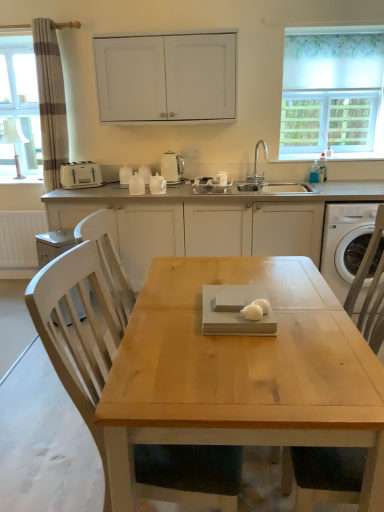
Question: From a real-world perspective, is white plastic dishwasher at lower left located beneath light wood chair at center?

Choices:
 (A) yes
 (B) no

Answer: (A)

Question: Does white plastic dishwasher at lower left have a greater width compared to light wood chair at center?

Choices:
 (A) yes
 (B) no

Answer: (B)

Question: Considering the relative sizes of white plastic dishwasher at lower left and light wood chair at center in the image provided, is white plastic dishwasher at lower left smaller than light wood chair at center?

Choices:
 (A) yes
 (B) no

Answer: (A)

Question: Can you confirm if white plastic dishwasher at lower left is shorter than light wood chair at center?

Choices:
 (A) no
 (B) yes

Answer: (B)

Question: Does white plastic dishwasher at lower left turn towards light wood chair at center?

Choices:
 (A) yes
 (B) no

Answer: (B)

Question: From the image's perspective, is silver metallic faucet at sink right above or below white plastic washing machine at right?

Choices:
 (A) below
 (B) above

Answer: (B)

Question: Considering the positions of point (266, 157) and point (334, 271), is point (266, 157) closer or farther from the camera than point (334, 271)?

Choices:
 (A) farther
 (B) closer

Answer: (A)

Question: Is silver metallic faucet at sink right situated inside white plastic washing machine at right or outside?

Choices:
 (A) outside
 (B) inside

Answer: (A)

Question: In terms of width, does silver metallic faucet at sink right look wider or thinner when compared to white plastic washing machine at right?

Choices:
 (A) wide
 (B) thin

Answer: (B)

Question: In terms of width, does white matte cabinet at upper center, which is the 1th cabinetry in top-to-bottom order, look wider or thinner when compared to white fabric at upper right?

Choices:
 (A) thin
 (B) wide

Answer: (B)

Question: Looking at the image, does white matte cabinet at upper center, the 2th cabinetry from the bottom, seem bigger or smaller compared to white fabric at upper right?

Choices:
 (A) small
 (B) big

Answer: (B)

Question: From a real-world perspective, is white matte cabinet at upper center, the 2th cabinetry from the bottom, positioned above or below white fabric at upper right?

Choices:
 (A) below
 (B) above

Answer: (B)

Question: Is white matte cabinet at upper center, the 2th cabinetry from the bottom, in front of or behind white fabric at upper right in the image?

Choices:
 (A) front
 (B) behind

Answer: (A)

Question: Visually, is white plastic dishwasher at lower left positioned to the left or to the right of white matte cabinetry at center, placed as the 1th cabinetry when sorted from bottom to top?

Choices:
 (A) left
 (B) right

Answer: (A)

Question: Looking at the image, does white plastic dishwasher at lower left seem bigger or smaller compared to white matte cabinetry at center, which ranks as the 2th cabinetry in top-to-bottom order?

Choices:
 (A) small
 (B) big

Answer: (A)